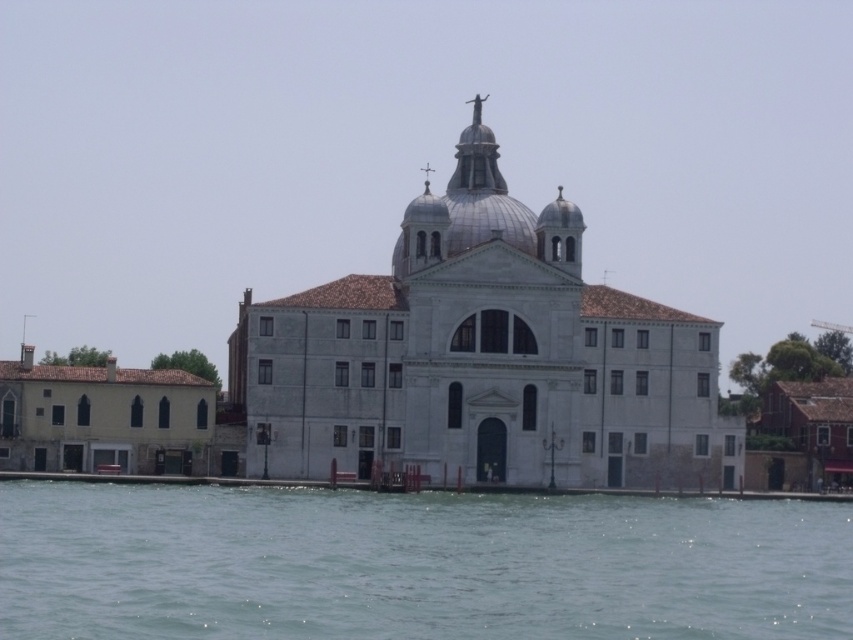
You are a photographer planning to capture the waterfront scene. You want to ensure that the clear water at lower center and the white stone church at center are both visible in your shot. Which object should you frame wider to include both in the composition?

The clear water at lower center should be framed wider because its width surpasses that of the white stone church at center, meaning it occupies more horizontal space in the scene.

You are standing at point A, which is located at coordinates (482, 356). What structure is directly beneath you?

The structure directly beneath you at point A is the white stone church at center.